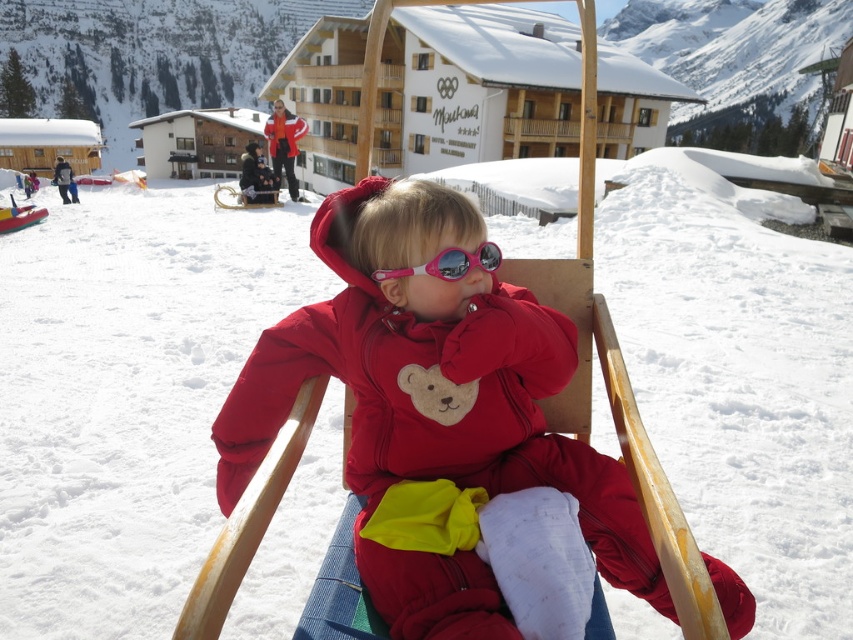
Question: Which is farther from the pink plastic goggles at center?

Choices:
 (A) matte red jacket at upper center
 (B) matte red snowsuit at center

Answer: (A)

Question: Which of the following is the closest to the observer?

Choices:
 (A) (490, 260)
 (B) (450, 301)

Answer: (A)

Question: Can you confirm if matte red snowsuit at center is positioned to the right of matte red jacket at upper center?

Choices:
 (A) no
 (B) yes

Answer: (B)

Question: Which of these objects is positioned farthest from the matte red snowsuit at center?

Choices:
 (A) matte red jacket at upper center
 (B) pink plastic goggles at center

Answer: (A)

Question: Is matte red snowsuit at center positioned before pink plastic goggles at center?

Choices:
 (A) yes
 (B) no

Answer: (A)

Question: Can you confirm if matte red snowsuit at center is positioned below pink plastic goggles at center?

Choices:
 (A) no
 (B) yes

Answer: (B)